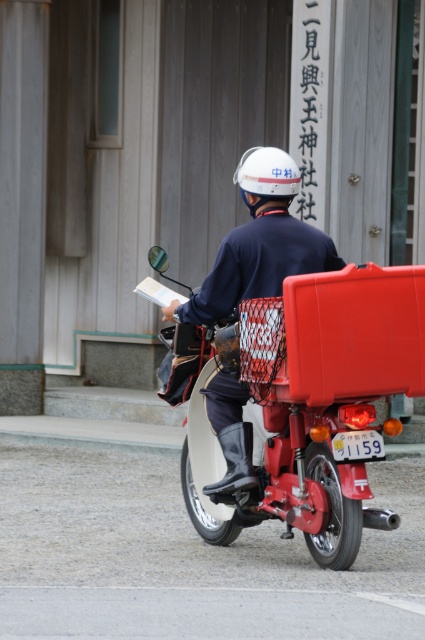
Question: Which object appears farthest from the camera in this image?

Choices:
 (A) metallic red motorcycle at center
 (B) matte white helmet at upper center
 (C) white matte helmet at center

Answer: (C)

Question: Is matte white helmet at upper center smaller than white matte helmet at center?

Choices:
 (A) no
 (B) yes

Answer: (A)

Question: Does matte white helmet at upper center have a smaller size compared to white matte helmet at center?

Choices:
 (A) no
 (B) yes

Answer: (A)

Question: Estimate the real-world distances between objects in this image. Which object is closer to the white matte helmet at center?

Choices:
 (A) metallic red motorcycle at center
 (B) matte white helmet at upper center

Answer: (B)

Question: Can you confirm if matte white helmet at upper center is positioned above white matte helmet at center?

Choices:
 (A) yes
 (B) no

Answer: (B)

Question: Which object is the farthest from the white matte helmet at center?

Choices:
 (A) matte white helmet at upper center
 (B) metallic red motorcycle at center

Answer: (B)